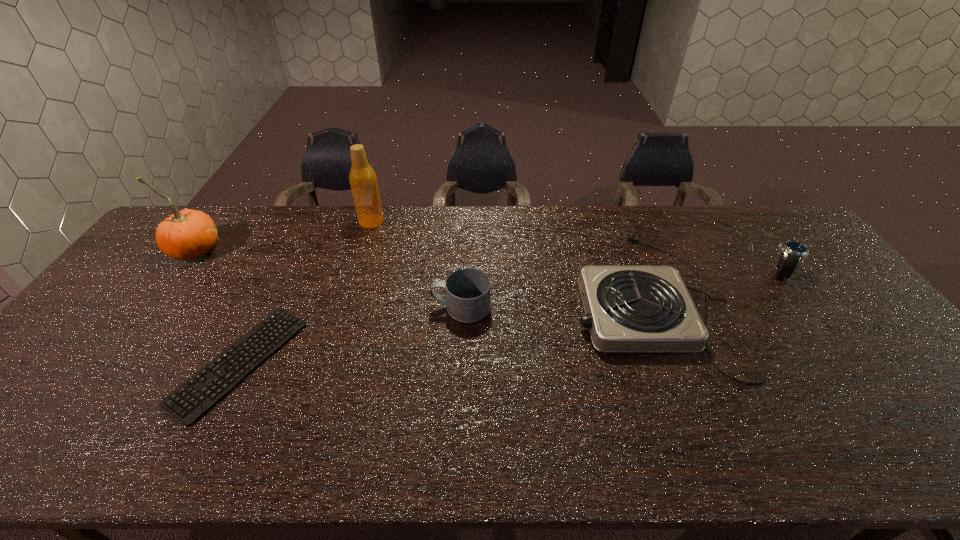
Image resolution: width=960 pixels, height=540 pixels. Find the location of `object that is the second nearest to the hotplate`. object that is the second nearest to the hotplate is located at coordinates (467, 290).

At what (x,y) coordinates should I click in order to perform the action: click on free space that satisfies the following two spatial constraints: 1. on the front side of the watch; 2. on the left side of the farthest object. Please return your answer as a coordinate pair (x, y). Looking at the image, I should click on tap(356, 272).